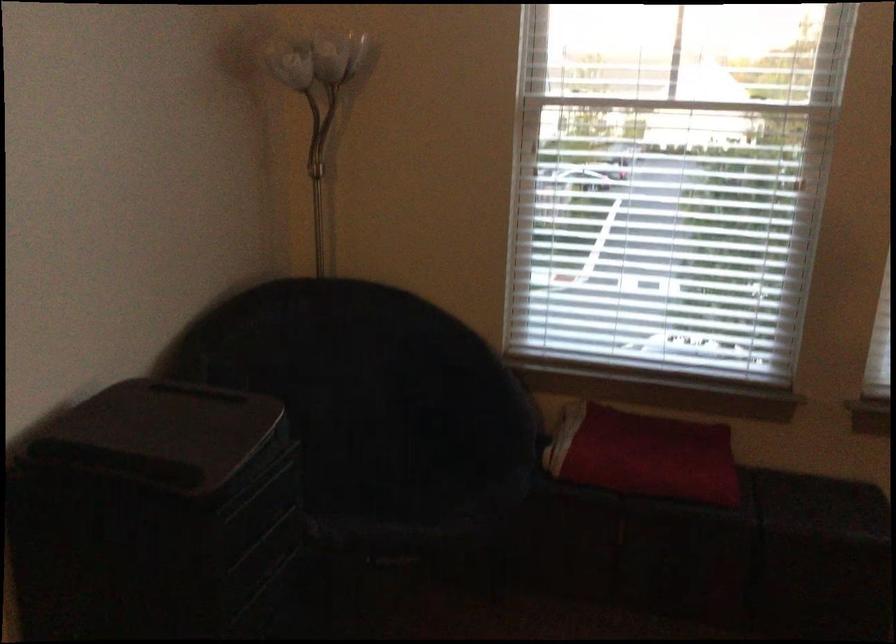
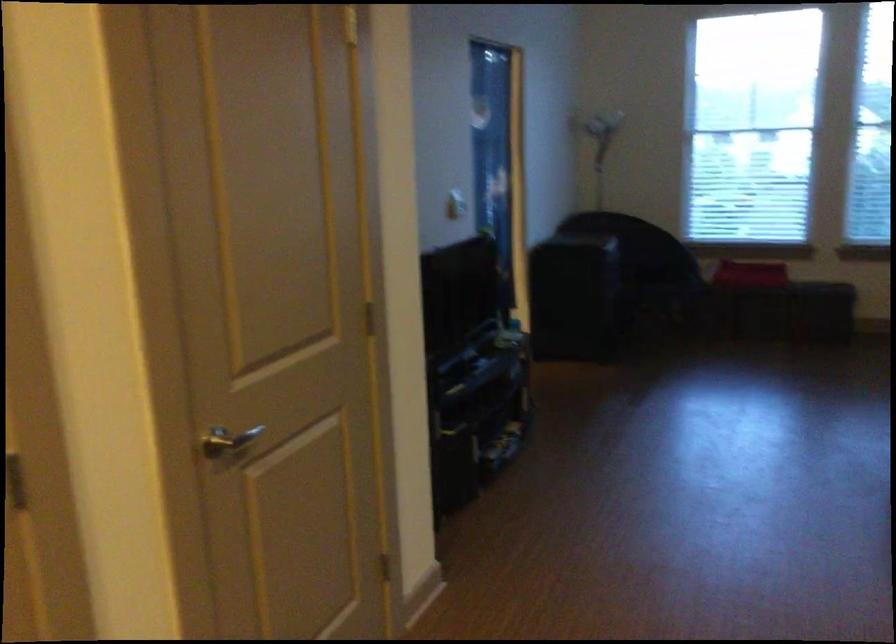
Question: What movement of the cameraman would produce the second image?

Choices:
 (A) Left
 (B) Right
 (C) Forward
 (D) Backward

Answer: (D)